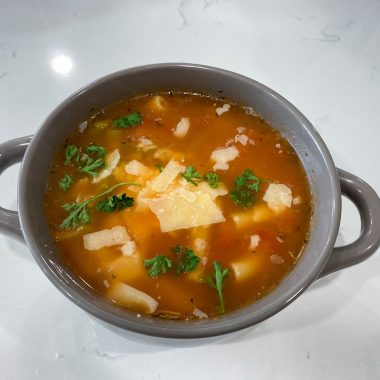
This screenshot has height=380, width=380. I want to click on handle, so click(x=12, y=147), click(x=364, y=190).